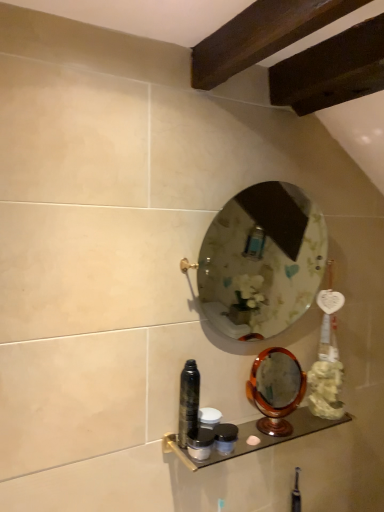
Question: Is clear glass mirror at center, acting as the 1th mirror starting from the top, located outside matte black container at lower center, placed as the first toiletry when sorted from bottom to top?

Choices:
 (A) no
 (B) yes

Answer: (B)

Question: Can you confirm if clear glass mirror at center, acting as the 1th mirror starting from the top, is taller than matte black container at lower center, which is the fourth toiletry from top to bottom?

Choices:
 (A) no
 (B) yes

Answer: (B)

Question: Is clear glass mirror at center, acting as the 1th mirror starting from the top, further to camera compared to matte black container at lower center, placed as the first toiletry when sorted from bottom to top?

Choices:
 (A) yes
 (B) no

Answer: (B)

Question: Is clear glass mirror at center, positioned as the 2th mirror in bottom-to-top order, directly adjacent to matte black container at lower center, placed as the first toiletry when sorted from bottom to top?

Choices:
 (A) no
 (B) yes

Answer: (A)

Question: Could matte black container at lower center, which is the fourth toiletry from top to bottom, be considered to be inside clear glass mirror at center, acting as the 1th mirror starting from the top?

Choices:
 (A) yes
 (B) no

Answer: (B)

Question: Is clear glass mirror at center, positioned as the 2th mirror in bottom-to-top order, bigger than matte black container at lower center, which is the fourth toiletry from top to bottom?

Choices:
 (A) no
 (B) yes

Answer: (B)

Question: From a real-world perspective, is wooden polished mirror at lower right, which is the second mirror in top-to-bottom order, over matte black container at lower center, the 3th toiletry when ordered from bottom to top?

Choices:
 (A) yes
 (B) no

Answer: (A)

Question: Is wooden polished mirror at lower right, positioned as the 1th mirror in bottom-to-top order, smaller than matte black container at lower center, the 3th toiletry when ordered from bottom to top?

Choices:
 (A) yes
 (B) no

Answer: (B)

Question: Does wooden polished mirror at lower right, which is the second mirror in top-to-bottom order, have a lesser height compared to matte black container at lower center, the 3th toiletry when ordered from bottom to top?

Choices:
 (A) yes
 (B) no

Answer: (B)

Question: Could you tell me if wooden polished mirror at lower right, positioned as the 1th mirror in bottom-to-top order, is facing matte black container at lower center, which is counted as the 2th toiletry, starting from the top?

Choices:
 (A) yes
 (B) no

Answer: (B)

Question: Is wooden polished mirror at lower right, which is the second mirror in top-to-bottom order, wider than matte black container at lower center, which is counted as the 2th toiletry, starting from the top?

Choices:
 (A) yes
 (B) no

Answer: (A)

Question: Does wooden polished mirror at lower right, which is the second mirror in top-to-bottom order, appear on the right side of matte black container at lower center, which is counted as the 2th toiletry, starting from the top?

Choices:
 (A) yes
 (B) no

Answer: (A)

Question: Does matte black container at center, the 3th toiletry from the top, have a greater width compared to matte black container at lower center, the 3th toiletry when ordered from bottom to top?

Choices:
 (A) no
 (B) yes

Answer: (A)